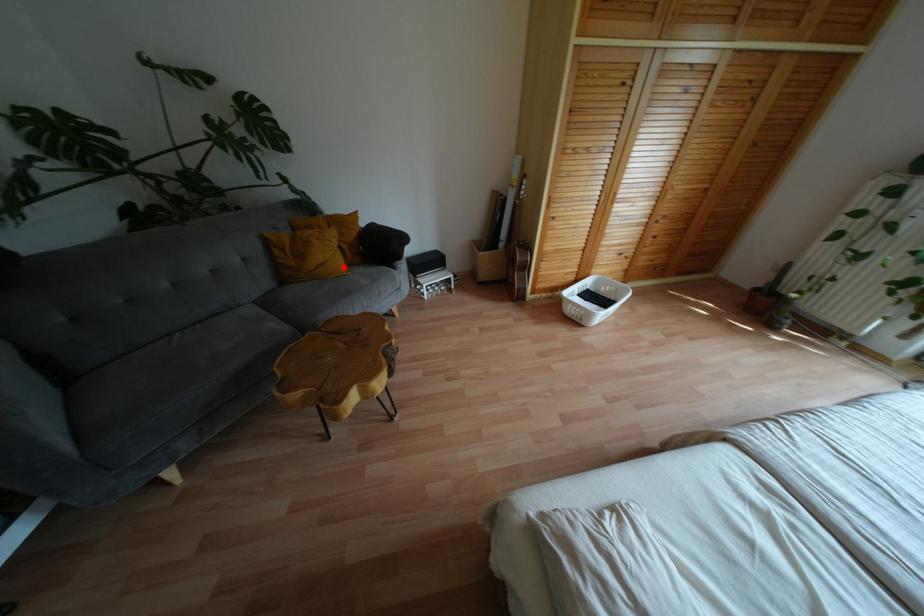
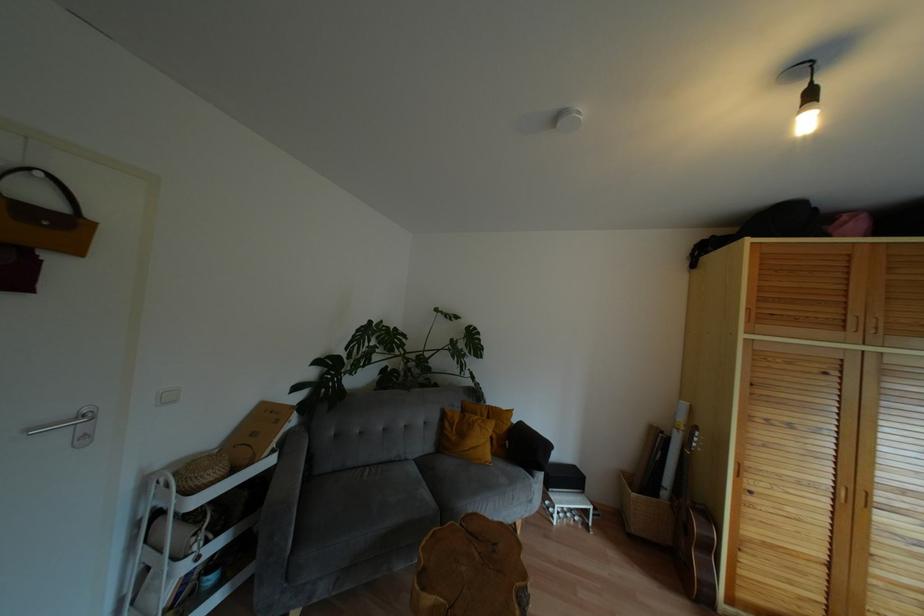
Question: A red point is marked in image1. In image2, is the corresponding 3D point closer to the camera or farther? Reply with the corresponding letter.

Choices:
 (A) The corresponding 3D point is closer.
 (B) The corresponding 3D point is farther.

Answer: (B)